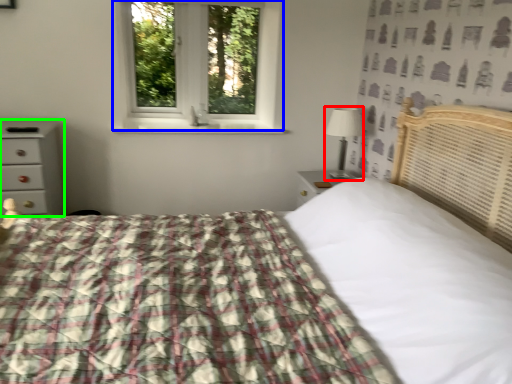
Question: Which object is the farthest from table lamp (highlighted by a red box)? Choose among these: window (highlighted by a blue box) or chest of drawers (highlighted by a green box).

Choices:
 (A) window
 (B) chest of drawers

Answer: (B)